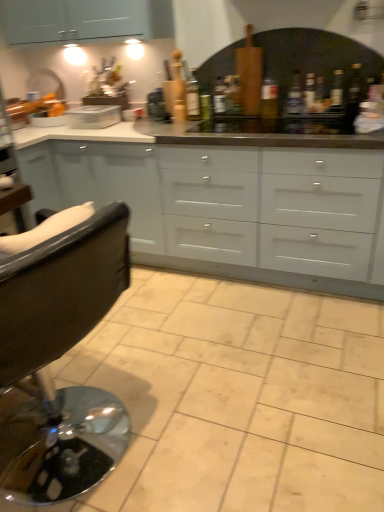
Identify the location of free space to the right of black leather chair at left. (211, 424).